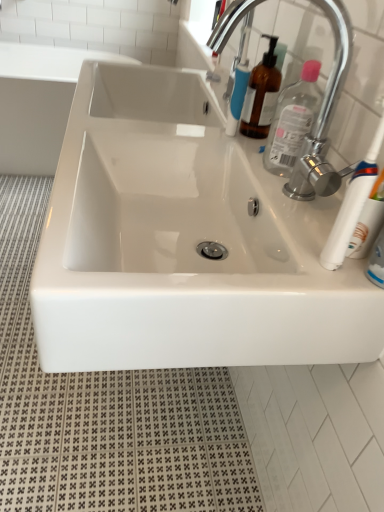
Question: From a real-world perspective, is chrome metallic faucet at upper right under white plastic toothbrush at right?

Choices:
 (A) yes
 (B) no

Answer: (B)

Question: From the image's perspective, is chrome metallic faucet at upper right located beneath white plastic toothbrush at right?

Choices:
 (A) yes
 (B) no

Answer: (B)

Question: Are chrome metallic faucet at upper right and white plastic toothbrush at right beside each other?

Choices:
 (A) yes
 (B) no

Answer: (B)

Question: Does chrome metallic faucet at upper right have a greater width compared to white plastic toothbrush at right?

Choices:
 (A) no
 (B) yes

Answer: (B)

Question: Is chrome metallic faucet at upper right taller than white plastic toothbrush at right?

Choices:
 (A) no
 (B) yes

Answer: (B)

Question: Is chrome metallic faucet at upper right smaller than white plastic toothbrush at right?

Choices:
 (A) no
 (B) yes

Answer: (A)

Question: Does white glossy sink at center have a lesser width compared to white glossy sink at upper left?

Choices:
 (A) yes
 (B) no

Answer: (A)

Question: Can you confirm if white glossy sink at center is shorter than white glossy sink at upper left?

Choices:
 (A) no
 (B) yes

Answer: (B)

Question: Does white glossy sink at center touch white glossy sink at upper left?

Choices:
 (A) no
 (B) yes

Answer: (A)

Question: Is white glossy sink at center positioned with its back to white glossy sink at upper left?

Choices:
 (A) yes
 (B) no

Answer: (B)

Question: Considering the relative sizes of white glossy sink at center and white glossy sink at upper left in the image provided, is white glossy sink at center wider than white glossy sink at upper left?

Choices:
 (A) yes
 (B) no

Answer: (B)

Question: Is the position of white glossy sink at center more distant than that of white glossy sink at upper left?

Choices:
 (A) yes
 (B) no

Answer: (B)

Question: From the image's perspective, does chrome metallic faucet at upper right appear lower than white glossy sink at center?

Choices:
 (A) yes
 (B) no

Answer: (B)